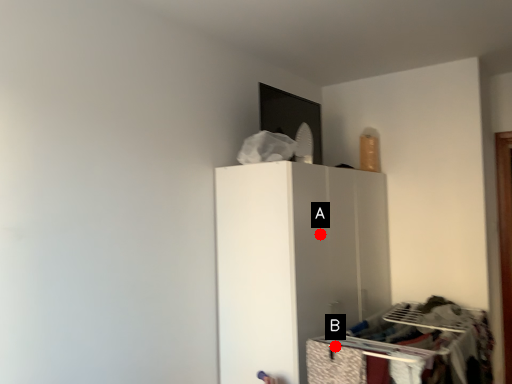
Question: Two points are circled on the image, labeled by A and B beside each circle. Which point is further to the camera?

Choices:
 (A) A is further
 (B) B is further

Answer: (A)